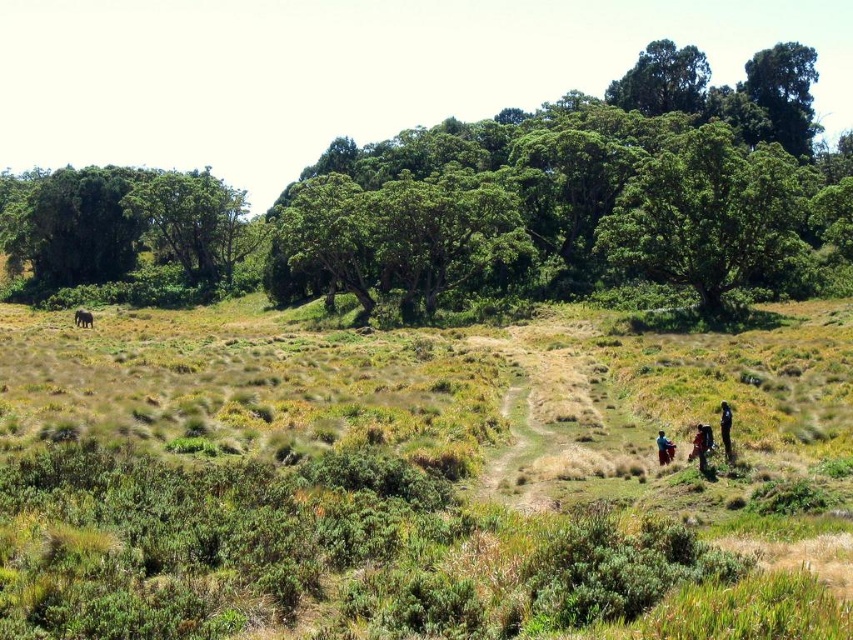
Does brown leather backpack at lower right appear on the right side of blue fabric person at lower right?

Yes, brown leather backpack at lower right is to the right of blue fabric person at lower right.

Consider the image. Which of these two, brown leather backpack at lower right or blue fabric person at lower right, stands shorter?

With less height is blue fabric person at lower right.

Locate an element on the screen. brown leather backpack at lower right is located at coordinates (701, 445).

Consider the image. Between multicolored fabric at lower right and dark blue fabric at lower right, which one is positioned lower?

multicolored fabric at lower right is below.

Is multicolored fabric at lower right to the right of dark blue fabric at lower right from the viewer's perspective?

In fact, multicolored fabric at lower right is to the left of dark blue fabric at lower right.

Which is in front, point (659, 451) or point (723, 417)?

Point (723, 417) is in front.

In order to click on multicolored fabric at lower right in this screenshot , I will do `click(701, 445)`.

Based on the photo, who is positioned more to the right, dark blue fabric at lower right or blue fabric person at lower right?

Positioned to the right is dark blue fabric at lower right.

Who is more forward, (x=723, y=413) or (x=662, y=458)?

Positioned in front is point (x=723, y=413).

In order to click on dark blue fabric at lower right in this screenshot , I will do `click(726, 429)`.